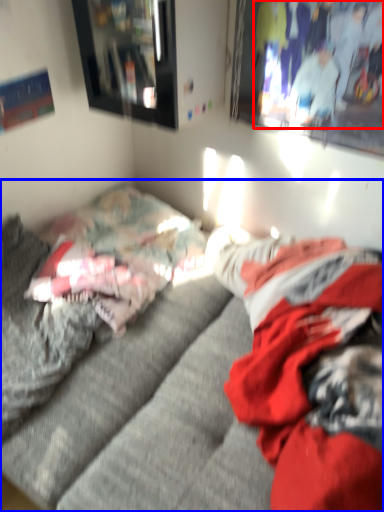
Question: Among these objects, which one is farthest to the camera, couple (highlighted by a red box) or studio couch (highlighted by a blue box)?

Choices:
 (A) couple
 (B) studio couch

Answer: (A)